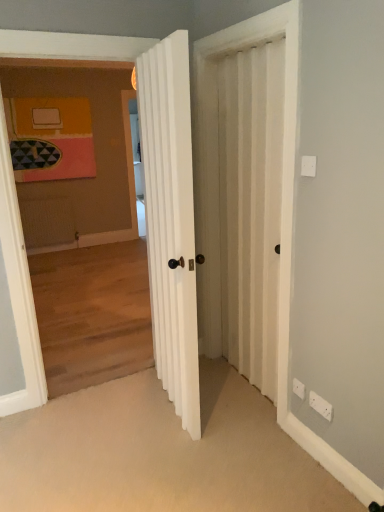
What is the approximate width of white plastic electric outlet at lower right, positioned as the 1th electric outlet in front-to-back order?

The width of white plastic electric outlet at lower right, positioned as the 1th electric outlet in front-to-back order, is 0.78 inches.

The height and width of the screenshot is (512, 384). What do you see at coordinates (283, 147) in the screenshot?
I see `white textured screen door at center` at bounding box center [283, 147].

How much space does white plastic electric outlet at lower right, acting as the 2th electric outlet starting from the front, occupy vertically?

8.49 centimeters.

What do you see at coordinates (299, 388) in the screenshot? This screenshot has height=512, width=384. I see `white plastic electric outlet at lower right, acting as the 2th electric outlet starting from the right` at bounding box center [299, 388].

Identify the location of white ribbed door at center. (170, 220).

Identify the location of white plastic electric outlet at lower right, the second electric outlet when ordered from left to right. (321, 406).

The width and height of the screenshot is (384, 512). In the image, there is a white plastic electric outlet at lower right, the second electric outlet when ordered from left to right. Identify the location of electric outlet above it (from the image's perspective). (299, 388).

Based on the photo, from their relative heights in the image, would you say white plastic electric outlet at lower right, acting as the 2th electric outlet starting from the front, is taller or shorter than white plastic electric outlet at lower right, acting as the 1th electric outlet starting from the right?

In the image, white plastic electric outlet at lower right, acting as the 2th electric outlet starting from the front, appears to be shorter than white plastic electric outlet at lower right, acting as the 1th electric outlet starting from the right.

Is white plastic electric outlet at lower right, acting as the 2th electric outlet starting from the front, positioned in front of white plastic electric outlet at lower right, positioned as the 1th electric outlet in front-to-back order?

No, it is not.

Consider the image. Can you see white plastic electric outlet at lower right, acting as the 2th electric outlet starting from the right, touching white plastic electric outlet at lower right, positioned as the 1th electric outlet in front-to-back order?

white plastic electric outlet at lower right, acting as the 2th electric outlet starting from the right, and white plastic electric outlet at lower right, positioned as the 1th electric outlet in front-to-back order, are not in contact.

From a real-world perspective, is white plastic electric outlet at lower right, which is counted as the 1th electric outlet, starting from the back, positioned above or below white textured screen door at center?

white plastic electric outlet at lower right, which is counted as the 1th electric outlet, starting from the back, is situated lower than white textured screen door at center in the real world.

Does white plastic electric outlet at lower right, which is counted as the 1th electric outlet, starting from the back, appear on the left side of white textured screen door at center?

In fact, white plastic electric outlet at lower right, which is counted as the 1th electric outlet, starting from the back, is to the right of white textured screen door at center.

From the image's perspective, starting from the white textured screen door at center, which electric outlet is the 1st one below? Please provide its 2D coordinates.

[(299, 388)]

Would you say white plastic electric outlet at lower right, which appears as the second electric outlet when viewed from the back, is to the left or to the right of white textured screen door at center in the picture?

Based on their positions, white plastic electric outlet at lower right, which appears as the second electric outlet when viewed from the back, is located to the right of white textured screen door at center.

Is white plastic electric outlet at lower right, which appears as the second electric outlet when viewed from the back, shorter than white textured screen door at center?

Correct, white plastic electric outlet at lower right, which appears as the second electric outlet when viewed from the back, is not as tall as white textured screen door at center.

How much distance is there between white plastic electric outlet at lower right, positioned as the 1th electric outlet in front-to-back order, and white textured screen door at center?

white plastic electric outlet at lower right, positioned as the 1th electric outlet in front-to-back order, is 1.01 meters from white textured screen door at center.

From the picture: Between white plastic electric outlet at lower right, which appears as the second electric outlet when viewed from the back, and white textured screen door at center, which one has smaller size?

Smaller between the two is white plastic electric outlet at lower right, which appears as the second electric outlet when viewed from the back.

From a real-world perspective, is white plastic electric outlet at lower right, which appears as the second electric outlet when viewed from the back, positioned over white ribbed door at center based on gravity?

No.

Is white plastic electric outlet at lower right, acting as the 1th electric outlet starting from the right, positioned with its back to white ribbed door at center?

No, white plastic electric outlet at lower right, acting as the 1th electric outlet starting from the right,'s orientation is not away from white ribbed door at center.

Where is `the 2nd electric outlet positioned below the white ribbed door at center (from the image's perspective)`? This screenshot has width=384, height=512. the 2nd electric outlet positioned below the white ribbed door at center (from the image's perspective) is located at coordinates (321, 406).

Is white plastic electric outlet at lower right, positioned as the 1th electric outlet in front-to-back order, surrounding white ribbed door at center?

No, white ribbed door at center is located outside of white plastic electric outlet at lower right, positioned as the 1th electric outlet in front-to-back order.

Is white textured screen door at center to the right of white ribbed door at center from the viewer's perspective?

Indeed, white textured screen door at center is positioned on the right side of white ribbed door at center.

From the image's perspective, is white textured screen door at center below white ribbed door at center?

Incorrect, from the image's perspective, white textured screen door at center is higher than white ribbed door at center.

Considering the points (287, 93) and (164, 340), which point is behind, point (287, 93) or point (164, 340)?

The point (164, 340) is behind.

Between white textured screen door at center and white ribbed door at center, which one has smaller width?

With smaller width is white textured screen door at center.

At what (x,y) coordinates should I click in order to perform the action: click on electric outlet that is the 1st object directly below the white textured screen door at center (from a real-world perspective). Please return your answer as a coordinate pair (x, y). This screenshot has height=512, width=384. Looking at the image, I should click on (299, 388).

Which is less distant, (293, 175) or (301, 386)?

The point (293, 175) is in front.

Considering the positions of objects white textured screen door at center and white plastic electric outlet at lower right, acting as the 2th electric outlet starting from the front, in the image provided, who is more to the right, white textured screen door at center or white plastic electric outlet at lower right, acting as the 2th electric outlet starting from the front,?

From the viewer's perspective, white plastic electric outlet at lower right, acting as the 2th electric outlet starting from the front, appears more on the right side.

Could you tell me if white textured screen door at center is turned towards white plastic electric outlet at lower right, which is counted as the 1th electric outlet, starting from the back?

No, white textured screen door at center is not oriented towards white plastic electric outlet at lower right, which is counted as the 1th electric outlet, starting from the back.

Where is `electric outlet below the white plastic electric outlet at lower right, the 1th electric outlet from the left (from a real-world perspective)`? Image resolution: width=384 pixels, height=512 pixels. electric outlet below the white plastic electric outlet at lower right, the 1th electric outlet from the left (from a real-world perspective) is located at coordinates tap(321, 406).

Can you confirm if white plastic electric outlet at lower right, which appears as the second electric outlet when viewed from the back, is smaller than white plastic electric outlet at lower right, acting as the 2th electric outlet starting from the right?

No.

From the picture: Which object is more forward, white plastic electric outlet at lower right, positioned as the 1th electric outlet in front-to-back order, or white plastic electric outlet at lower right, which is counted as the 1th electric outlet, starting from the back?

white plastic electric outlet at lower right, positioned as the 1th electric outlet in front-to-back order, is closer to the camera.

Is white plastic electric outlet at lower right, the 1th electric outlet from the left, a part of white plastic electric outlet at lower right, acting as the 1th electric outlet starting from the right?

Definitely not — white plastic electric outlet at lower right, the 1th electric outlet from the left, is not inside white plastic electric outlet at lower right, acting as the 1th electric outlet starting from the right.

In the image, there is a white plastic electric outlet at lower right, which is counted as the 1th electric outlet, starting from the back. Identify the location of electric outlet below it (from the image's perspective). (321, 406).

I want to click on the 1st electric outlet to the right of the white textured screen door at center, starting your count from the anchor, so click(299, 388).

Based on their spatial positions, is white textured screen door at center or white plastic electric outlet at lower right, positioned as the 1th electric outlet in front-to-back order, further from white plastic electric outlet at lower right, which is counted as the 1th electric outlet, starting from the back?

white textured screen door at center is further to white plastic electric outlet at lower right, which is counted as the 1th electric outlet, starting from the back.

Looking at the image, which one is located further to white textured screen door at center, white plastic electric outlet at lower right, the second electric outlet when ordered from left to right, or white ribbed door at center?

white plastic electric outlet at lower right, the second electric outlet when ordered from left to right, is positioned further to the anchor white textured screen door at center.

When comparing their distances from white ribbed door at center, does white textured screen door at center or white plastic electric outlet at lower right, which is counted as the 1th electric outlet, starting from the back, seem closer?

white textured screen door at center is positioned closer to the anchor white ribbed door at center.

From the image, which object appears to be nearer to white plastic electric outlet at lower right, the second electric outlet when ordered from left to right, white textured screen door at center or white ribbed door at center?

white textured screen door at center.

From the image, which object appears to be nearer to white plastic electric outlet at lower right, acting as the 2th electric outlet starting from the right, white textured screen door at center or white ribbed door at center?

white ribbed door at center.

When comparing their distances from white textured screen door at center, does white plastic electric outlet at lower right, which appears as the second electric outlet when viewed from the back, or white plastic electric outlet at lower right, acting as the 2th electric outlet starting from the front, seem further?

The object further to white textured screen door at center is white plastic electric outlet at lower right, acting as the 2th electric outlet starting from the front.

From the image, which object appears to be farther from white plastic electric outlet at lower right, acting as the 2th electric outlet starting from the front, white ribbed door at center or white textured screen door at center?

Based on the image, white textured screen door at center appears to be further to white plastic electric outlet at lower right, acting as the 2th electric outlet starting from the front.

Considering their positions, is white plastic electric outlet at lower right, which is counted as the 1th electric outlet, starting from the back, positioned further to white plastic electric outlet at lower right, which appears as the second electric outlet when viewed from the back, than white ribbed door at center?

white ribbed door at center is further to white plastic electric outlet at lower right, which appears as the second electric outlet when viewed from the back.

Image resolution: width=384 pixels, height=512 pixels. Find the location of `electric outlet that lies between white ribbed door at center and white plastic electric outlet at lower right, positioned as the 1th electric outlet in front-to-back order, from top to bottom`. electric outlet that lies between white ribbed door at center and white plastic electric outlet at lower right, positioned as the 1th electric outlet in front-to-back order, from top to bottom is located at coordinates (299, 388).

Locate an element on the screen. This screenshot has height=512, width=384. electric outlet between white textured screen door at center and white plastic electric outlet at lower right, positioned as the 1th electric outlet in front-to-back order, from top to bottom is located at coordinates (299, 388).

Locate an element on the screen. Image resolution: width=384 pixels, height=512 pixels. door that lies between white textured screen door at center and white plastic electric outlet at lower right, the 1th electric outlet from the left, from top to bottom is located at coordinates (170, 220).

Find the location of `door between white textured screen door at center and white plastic electric outlet at lower right, positioned as the 1th electric outlet in front-to-back order, in the vertical direction`. door between white textured screen door at center and white plastic electric outlet at lower right, positioned as the 1th electric outlet in front-to-back order, in the vertical direction is located at coordinates (170, 220).